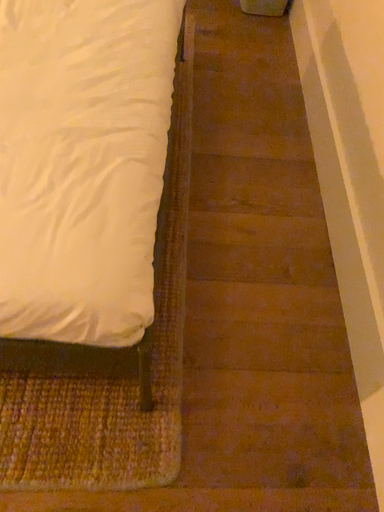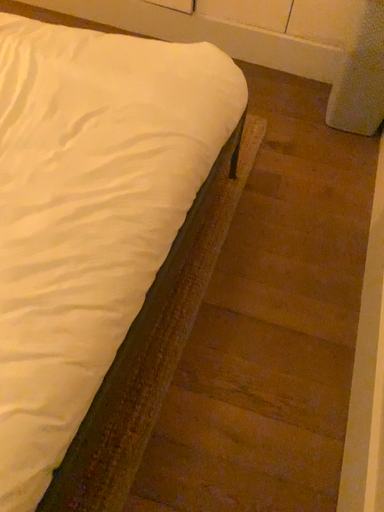
Question: Which way did the camera rotate in the video?

Choices:
 (A) rotated right
 (B) rotated left

Answer: (B)